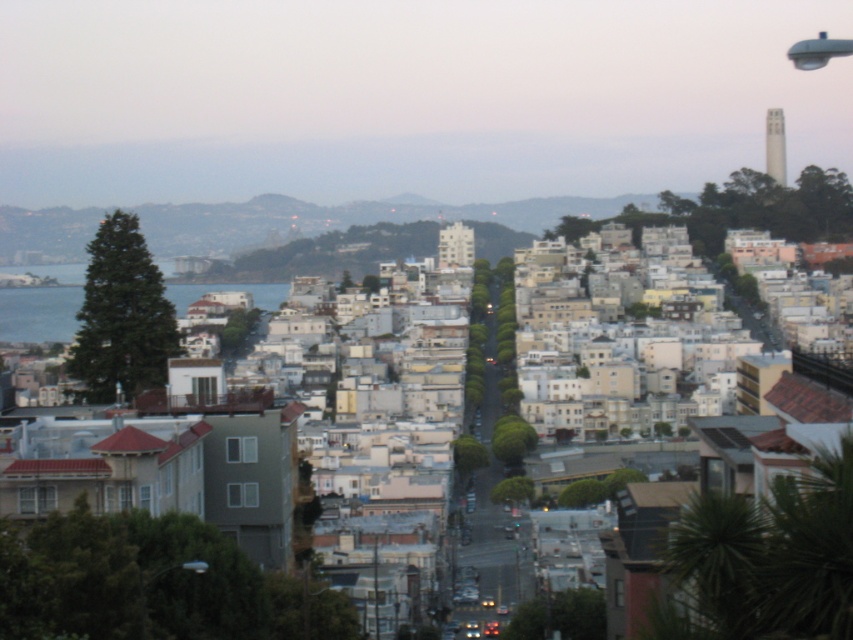
Is point (250, 225) in front of point (78, 291)?

Yes, it is in front of point (78, 291).

Who is higher up, green grassy hillside at center or blue water at left?

green grassy hillside at center

Between point (194, 211) and point (177, 307), which one is positioned in front?

Point (177, 307) is in front.

Locate an element on the screen. This screenshot has width=853, height=640. green grassy hillside at center is located at coordinates (341, 218).